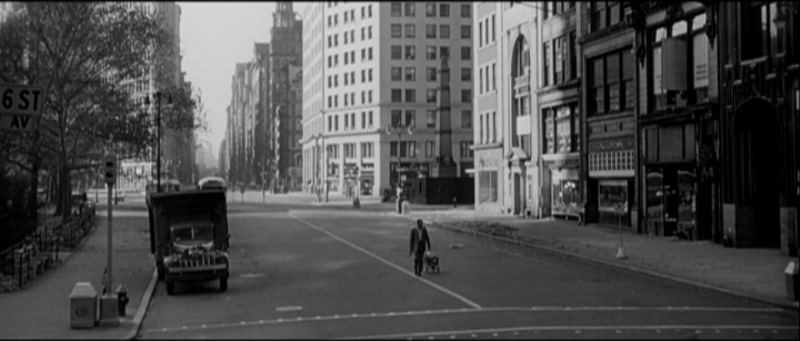
Where is `garbage can`? garbage can is located at coordinates (80, 316).